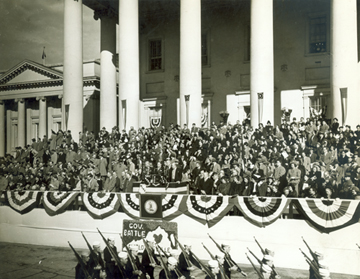
This screenshot has width=360, height=279. In order to click on speaker in this screenshot , I will do `click(175, 167)`.